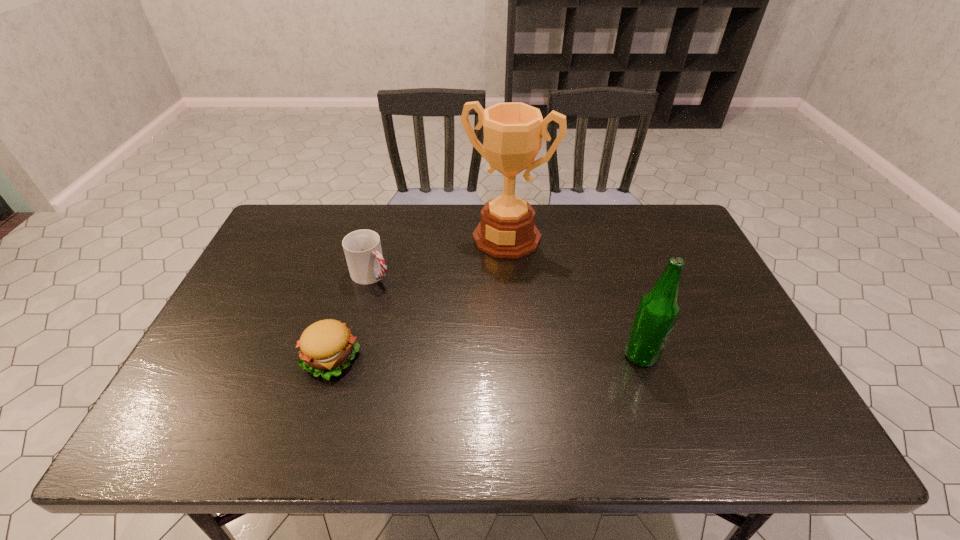
You are a GUI agent. You are given a task and a screenshot of the screen. Output one action in this format:
    pyautogui.click(x=<x>, y=<y>)
    Task: Click on the vacant area between the hamburger and the award
    Image resolution: width=960 pixels, height=540 pixels.
    Given the screenshot: What is the action you would take?
    pyautogui.click(x=419, y=298)

The image size is (960, 540). I want to click on unoccupied area between the second shortest object and the third object from left to right, so click(x=440, y=255).

Identify the location of free space that is in between the tallest object and the shortest object. Image resolution: width=960 pixels, height=540 pixels. (419, 298).

Find the location of `object that is the closest to the shortest object`. object that is the closest to the shortest object is located at coordinates (362, 248).

At what (x,y) coordinates should I click in order to perform the action: click on object that stands as the third closest to the award. Please return your answer as a coordinate pair (x, y). The height and width of the screenshot is (540, 960). Looking at the image, I should click on (327, 346).

In order to click on free space that satisfies the following two spatial constraints: 1. on the back side of the hamburger; 2. on the label of the rightmost object in this screenshot , I will do `click(332, 355)`.

You are a GUI agent. You are given a task and a screenshot of the screen. Output one action in this format:
    pyautogui.click(x=<x>, y=<y>)
    Task: Click on the free space in the image that satisfies the following two spatial constraints: 1. on the back side of the shortest object; 2. on the left side of the second shortest object
    
    Given the screenshot: What is the action you would take?
    pyautogui.click(x=357, y=274)

This screenshot has height=540, width=960. I want to click on vacant position in the image that satisfies the following two spatial constraints: 1. on the front side of the cup; 2. on the label of the rightmost object, so click(x=350, y=355).

Where is `free region that satisfies the following two spatial constraints: 1. on the front side of the beer bottle; 2. on the label of the third nearest object`? The height and width of the screenshot is (540, 960). free region that satisfies the following two spatial constraints: 1. on the front side of the beer bottle; 2. on the label of the third nearest object is located at coordinates (350, 355).

Where is `vacant space that satisfies the following two spatial constraints: 1. on the back side of the third shortest object; 2. on the label of the shortest object`? The image size is (960, 540). vacant space that satisfies the following two spatial constraints: 1. on the back side of the third shortest object; 2. on the label of the shortest object is located at coordinates (332, 355).